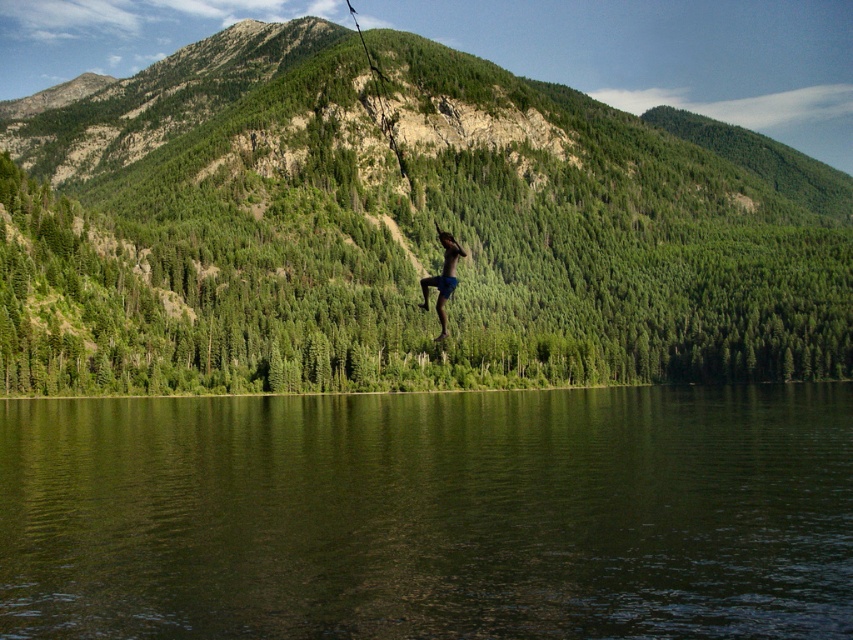
Question: Which object is closer to the camera taking this photo?

Choices:
 (A) green smooth water at center
 (B) blue denim shorts at center
 (C) green forested mountain at center

Answer: (A)

Question: Considering the relative positions of green forested mountain at center and blue denim shorts at center in the image provided, where is green forested mountain at center located with respect to blue denim shorts at center?

Choices:
 (A) left
 (B) right

Answer: (B)

Question: Considering the relative positions of green smooth water at center and blue denim shorts at center in the image provided, where is green smooth water at center located with respect to blue denim shorts at center?

Choices:
 (A) above
 (B) below

Answer: (B)

Question: Which of the following is the farthest from the observer?

Choices:
 (A) green smooth water at center
 (B) green forested mountain at center

Answer: (B)

Question: Among these objects, which one is farthest from the camera?

Choices:
 (A) green smooth water at center
 (B) green forested mountain at center

Answer: (B)

Question: Can you confirm if green smooth water at center is thinner than blue denim shorts at center?

Choices:
 (A) yes
 (B) no

Answer: (B)